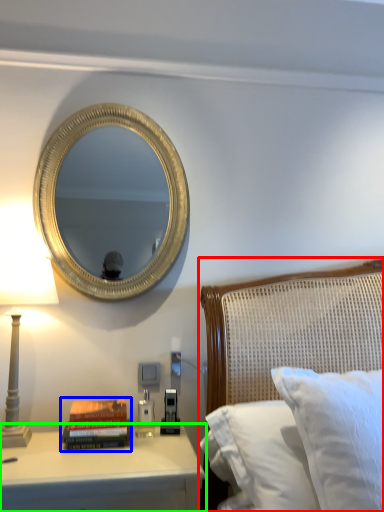
Question: Which is farther away from bed (highlighted by a red box)? paperback book (highlighted by a blue box) or nightstand (highlighted by a green box)?

Choices:
 (A) paperback book
 (B) nightstand

Answer: (A)